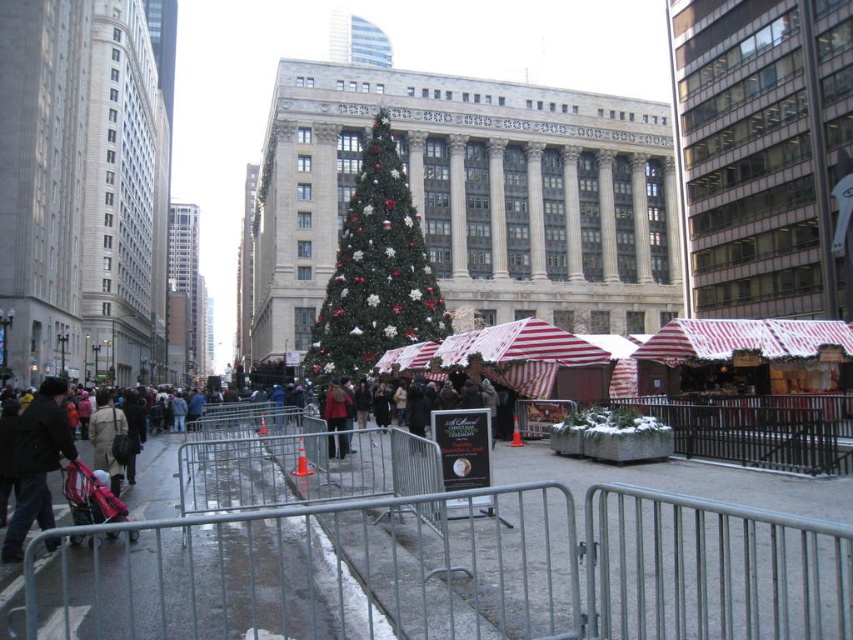
You are standing in the city plaza and want to take a photo of the green matte Christmas tree at center. Given the barricades in the foreground, can you estimate if you can walk directly to the tree without obstacles?

The green matte Christmas tree at center is located at point [376,269], which is in the foreground near the barricades. Since the barricades are set up to manage pedestrian traffic, you may need to navigate around them to reach the tree directly.

You are standing in the city plaza and want to take a photo of both the festive Christmas tree and the market stalls under the red and white striped canopies. You notice two points marked as point 1 at coordinates (x=409, y=314) and point 2 at coordinates (x=338, y=413). Which point should you stand at to ensure both the Christmas tree and the market stalls are in your frame without needing to move your camera position?

You should stand at point 1 at coordinates (x=409, y=314) because it is closer to the camera, allowing you to capture both the festive Christmas tree and the market stalls under the red and white striped canopies in your frame without needing to move your camera position.